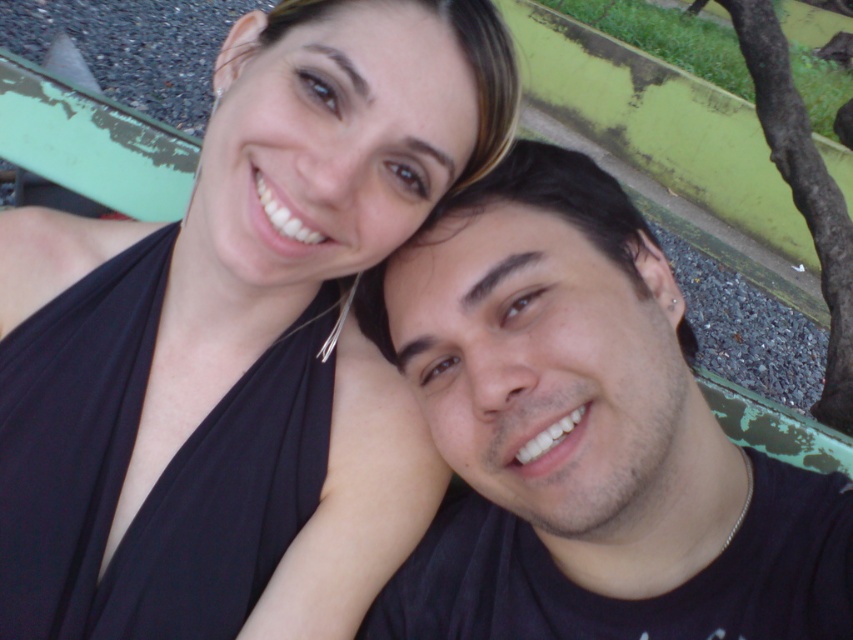
Question: Does black fabric at upper left lie behind black matte shirt at center?

Choices:
 (A) yes
 (B) no

Answer: (B)

Question: Which point appears closest to the camera in this image?

Choices:
 (A) tap(555, 579)
 (B) tap(457, 3)

Answer: (B)

Question: Which of the following is the closest to the observer?

Choices:
 (A) (561, 314)
 (B) (160, 280)

Answer: (A)

Question: Observing the image, what is the correct spatial positioning of black fabric at upper left in reference to black matte shirt at center?

Choices:
 (A) below
 (B) above

Answer: (B)

Question: In this image, where is black fabric at upper left located relative to black matte shirt at center?

Choices:
 (A) right
 (B) left

Answer: (B)